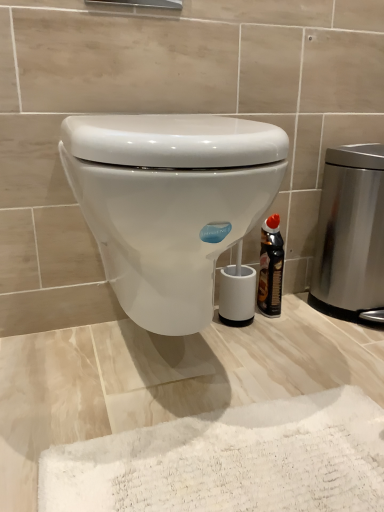
Question: Looking at the image, does stainless steel trash can at right seem bigger or smaller compared to black glossy bottle at right?

Choices:
 (A) big
 (B) small

Answer: (A)

Question: Is stainless steel trash can at right to the left or to the right of black glossy bottle at right in the image?

Choices:
 (A) left
 (B) right

Answer: (B)

Question: Estimate the real-world distances between objects in this image. Which object is farther from the white glossy toilet at center?

Choices:
 (A) stainless steel trash can at right
 (B) black glossy bottle at right

Answer: (A)

Question: Estimate the real-world distances between objects in this image. Which object is farther from the stainless steel trash can at right?

Choices:
 (A) black glossy bottle at right
 (B) white glossy toilet at center

Answer: (B)